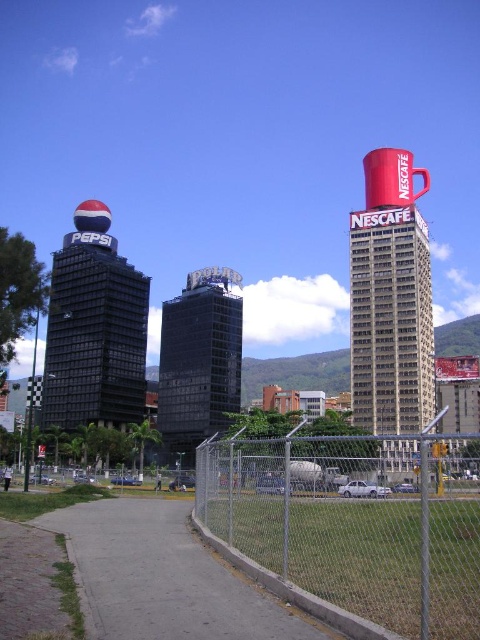
Question: Which object appears closest to the camera in this image?

Choices:
 (A) gray concrete pavement at lower left
 (B) black glass building at center

Answer: (A)

Question: Considering the relative positions of gray concrete pavement at lower left and shiny black building at left in the image provided, where is gray concrete pavement at lower left located with respect to shiny black building at left?

Choices:
 (A) below
 (B) above

Answer: (A)

Question: Which of the following is the closest to the observer?

Choices:
 (A) shiny black building at left
 (B) black glass building at center
 (C) gray concrete pavement at lower left

Answer: (C)

Question: Can you confirm if red ceramic cup at upper center is positioned to the left of red matte mug at upper center?

Choices:
 (A) no
 (B) yes

Answer: (B)

Question: Among these points, which one is farthest from the camera?

Choices:
 (A) (327, 525)
 (B) (218, 340)

Answer: (B)

Question: Observing the image, what is the correct spatial positioning of silver chain-link fence at lower center in reference to gray concrete pavement at lower left?

Choices:
 (A) above
 (B) below

Answer: (B)